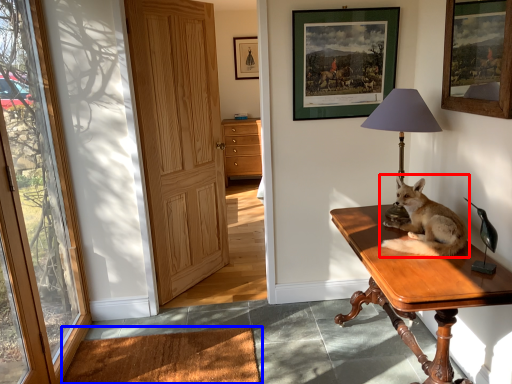
Question: Which of the following is the farthest to the observer, dog (highlighted by a red box) or mat (highlighted by a blue box)?

Choices:
 (A) dog
 (B) mat

Answer: (B)